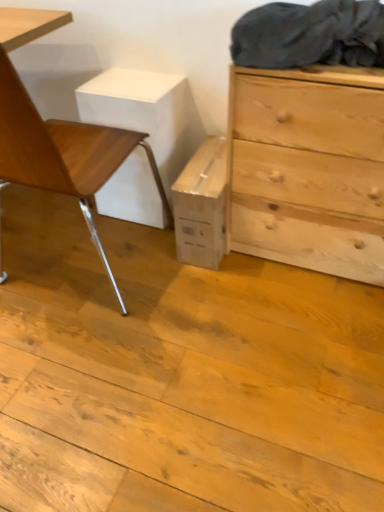
Question: Is wooden chair at left in front of dark gray fabric at upper right?

Choices:
 (A) no
 (B) yes

Answer: (B)

Question: Is wooden chair at left outside dark gray fabric at upper right?

Choices:
 (A) no
 (B) yes

Answer: (B)

Question: From the image's perspective, is wooden chair at left beneath dark gray fabric at upper right?

Choices:
 (A) yes
 (B) no

Answer: (A)

Question: Is wooden chair at left to the left of dark gray fabric at upper right from the viewer's perspective?

Choices:
 (A) yes
 (B) no

Answer: (A)

Question: Are wooden chair at left and dark gray fabric at upper right beside each other?

Choices:
 (A) yes
 (B) no

Answer: (B)

Question: From a real-world perspective, is dark gray fabric at upper right positioned above or below natural wood chest of drawers at right?

Choices:
 (A) below
 (B) above

Answer: (B)

Question: Would you say dark gray fabric at upper right is to the left or to the right of natural wood chest of drawers at right in the picture?

Choices:
 (A) left
 (B) right

Answer: (A)

Question: Looking at their shapes, would you say dark gray fabric at upper right is wider or thinner than natural wood chest of drawers at right?

Choices:
 (A) thin
 (B) wide

Answer: (A)

Question: From the image's perspective, relative to natural wood chest of drawers at right, is dark gray fabric at upper right above or below?

Choices:
 (A) above
 (B) below

Answer: (A)

Question: From the image's perspective, is natural wood chest of drawers at right positioned above or below wooden chair at left?

Choices:
 (A) above
 (B) below

Answer: (B)

Question: Would you say natural wood chest of drawers at right is inside or outside wooden chair at left?

Choices:
 (A) outside
 (B) inside

Answer: (A)

Question: Looking at their shapes, would you say natural wood chest of drawers at right is wider or thinner than wooden chair at left?

Choices:
 (A) thin
 (B) wide

Answer: (A)

Question: Relative to wooden chair at left, is natural wood chest of drawers at right in front or behind?

Choices:
 (A) front
 (B) behind

Answer: (B)

Question: From the image's perspective, relative to dark gray fabric at upper right, is natural wood chest of drawers at right above or below?

Choices:
 (A) above
 (B) below

Answer: (B)

Question: Is natural wood chest of drawers at right inside the boundaries of dark gray fabric at upper right, or outside?

Choices:
 (A) inside
 (B) outside

Answer: (B)